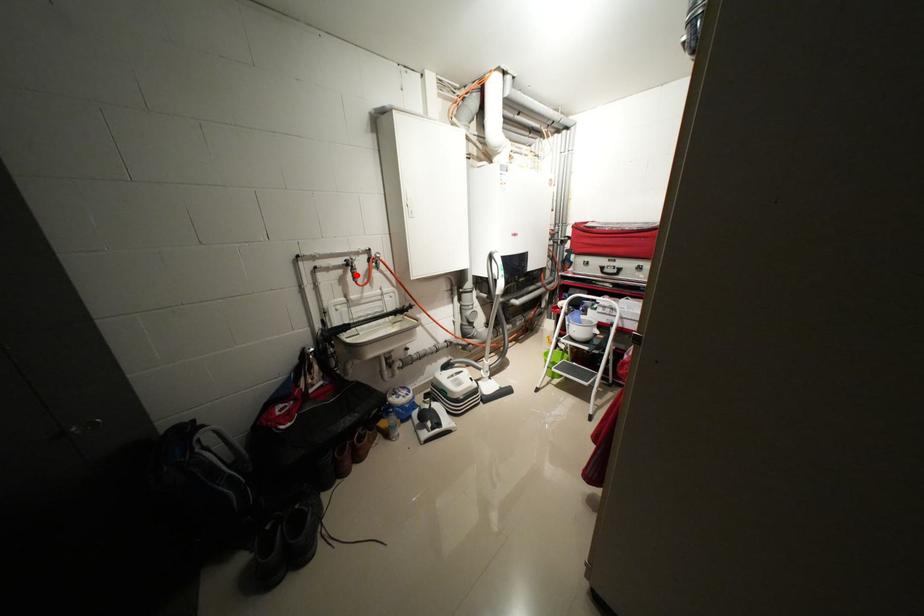
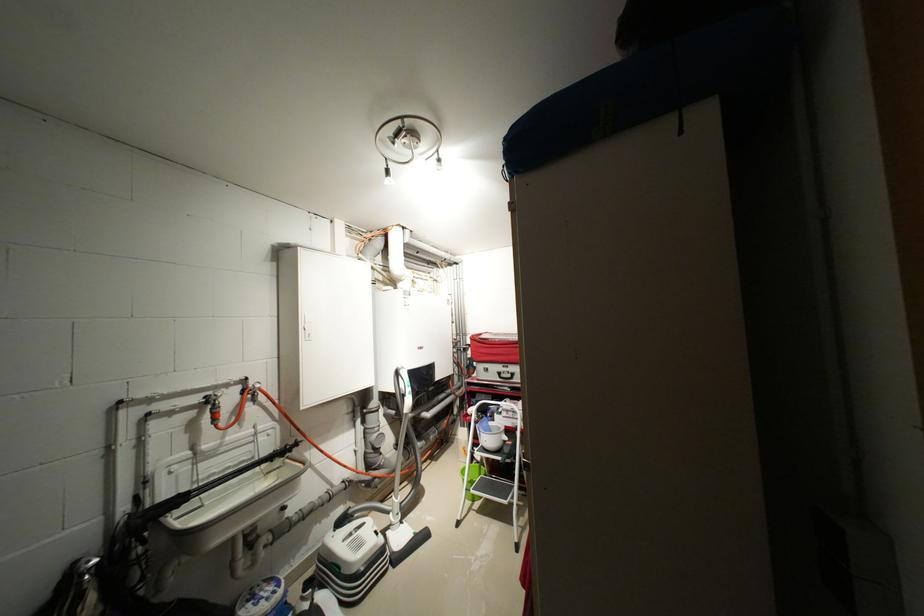
Locate, in the second image, the point that corresponds to the highlighted location in the first image.

(214, 416)